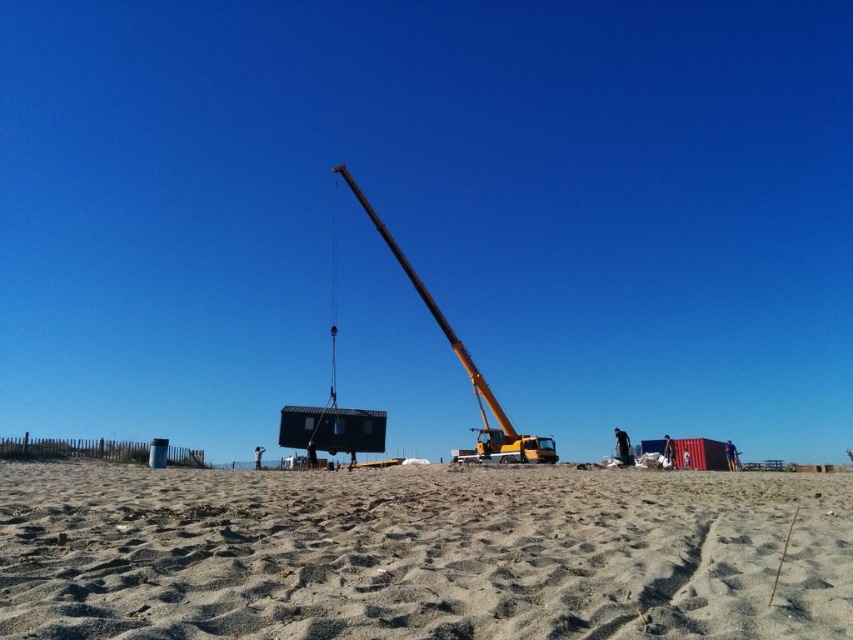
You are a construction worker who needs to transport a heavy equipment from the sandy beach at lower center to the yellow metallic crane at center. Considering the width of the path between them, can you safely move the equipment without any obstruction?

The sandy beach at lower center is wider than the yellow metallic crane at center, so the path between them is wide enough to safely move the equipment without obstruction.

You are standing at the point marked by the coordinates (421, 554) in the construction scene. What is the immediate surface you are standing on?

The point marked by the coordinates (421, 554) is on the sandy beach at lower center, so you are standing on sandy beach at lower center.